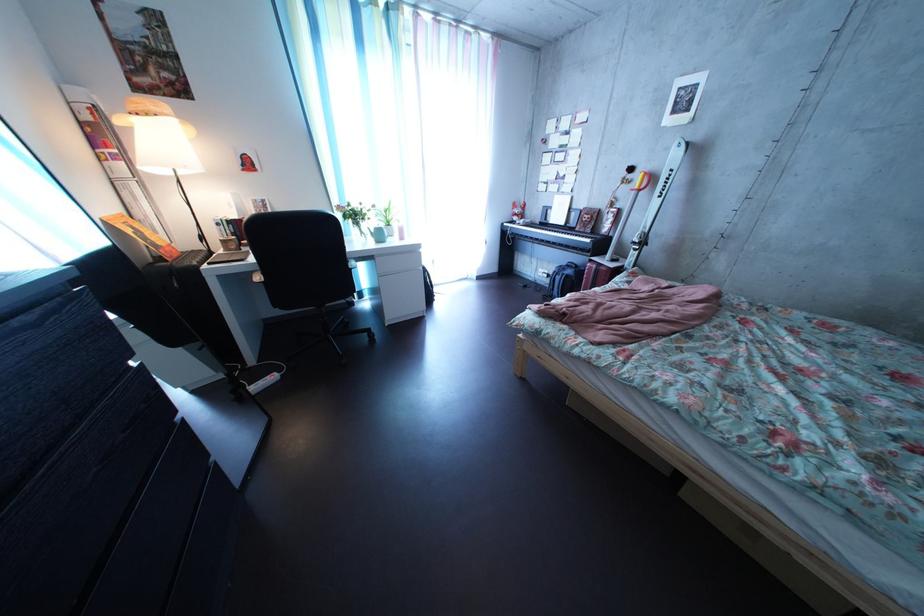
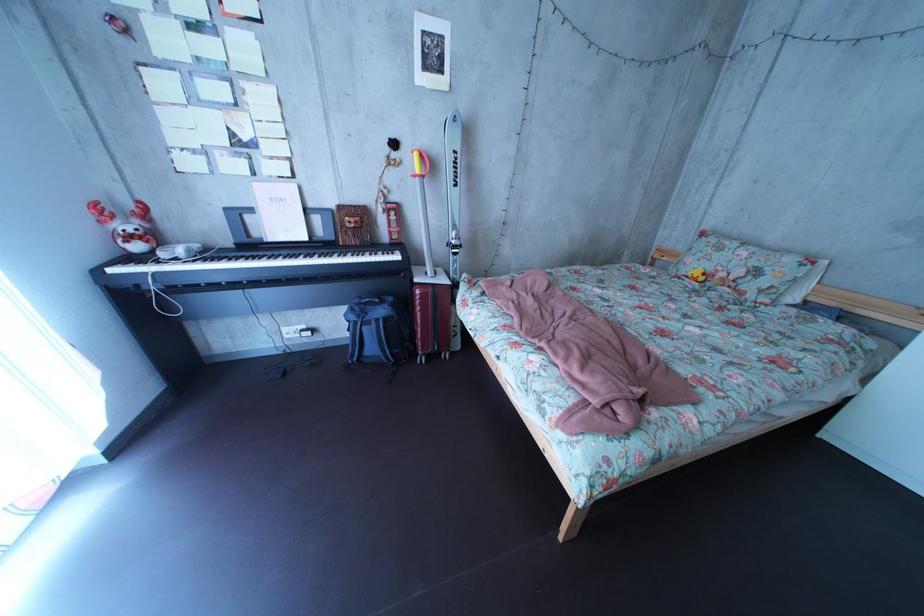
Where in the second image is the point corresponding to the point at 536,224 from the first image?

(169, 246)